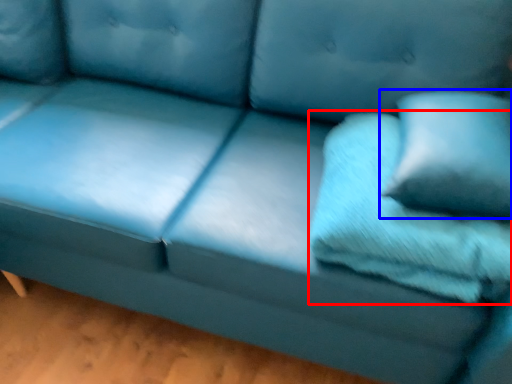
Question: Which point is further to the camera, pillow (highlighted by a red box) or pillow (highlighted by a blue box)?

Choices:
 (A) pillow
 (B) pillow

Answer: (A)